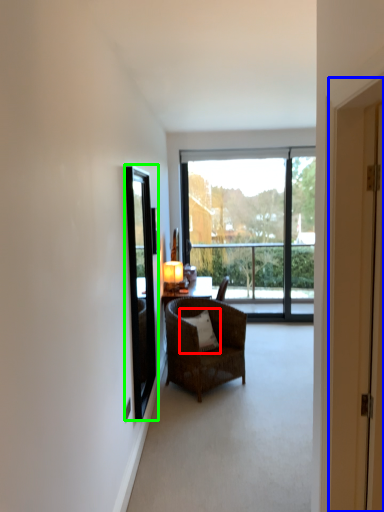
Question: Estimate the real-world distances between objects in this image. Which object is closer to pillow (highlighted by a red box), door (highlighted by a blue box) or window screen (highlighted by a green box)?

Choices:
 (A) door
 (B) window screen

Answer: (B)